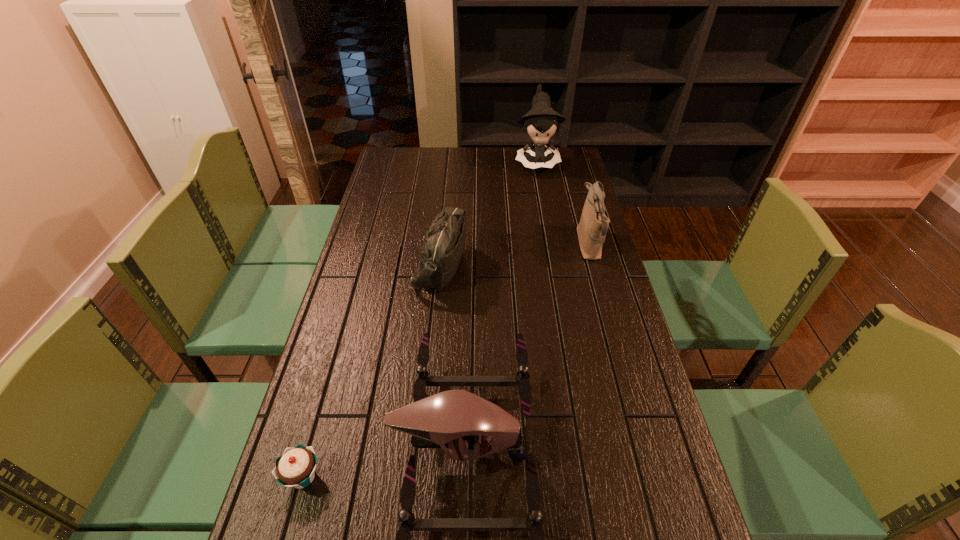
Locate an element on the screen. vacant area located at the front padded panel of the left shoulder bag is located at coordinates (536, 266).

Where is `free spot located on the front of the cupcake`? free spot located on the front of the cupcake is located at coordinates (288, 530).

I want to click on object situated at the far edge, so click(x=540, y=123).

At what (x,y) coordinates should I click in order to perform the action: click on object at the left edge. Please return your answer as a coordinate pair (x, y). The width and height of the screenshot is (960, 540). Looking at the image, I should click on (295, 468).

Where is `doll that is at the right edge`? The image size is (960, 540). doll that is at the right edge is located at coordinates 540,123.

The height and width of the screenshot is (540, 960). Identify the location of shoulder bag that is at the right edge. (592, 228).

I want to click on object at the far right corner, so click(540, 123).

This screenshot has height=540, width=960. I want to click on free spot at the far edge of the desktop, so click(471, 155).

Locate an element on the screen. This screenshot has width=960, height=540. vacant region at the left edge is located at coordinates (392, 185).

Where is `vacant space at the right edge`? The image size is (960, 540). vacant space at the right edge is located at coordinates (583, 307).